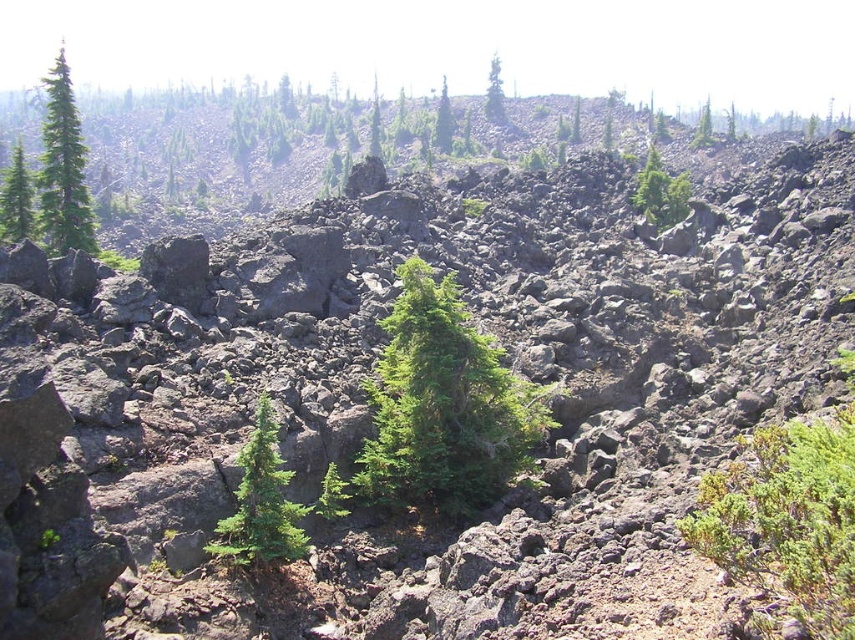
You are a hiker who wants to take a photo of both the green leafy tree at upper center and the green matte tree at upper center in the volcanic landscape. Which tree should you move closer to in order to capture both trees fully in your camera frame?

You should move closer to the green leafy tree at upper center because its width is smaller than the green matte tree at upper center, allowing both to fit within the camera frame when positioned appropriately.

You are planning to plant a new tree in this volcanic landscape. The new tree will have a width of 2 meters. Which existing tree, the green matte tree at upper left or the green matte tree at left, should you choose as a reference to ensure the new tree fits appropriately in the space?

The green matte tree at upper left has a larger width than the green matte tree at left. Since the new tree is 2 meters wide, you should choose the green matte tree at upper left as a reference to ensure the new tree fits appropriately in the space.